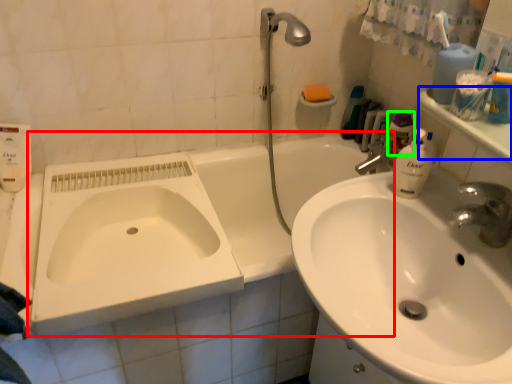
Question: Which object is positioned farthest from bath (highlighted by a red box)? Select from counter top (highlighted by a blue box) and toiletry (highlighted by a green box).

Choices:
 (A) counter top
 (B) toiletry

Answer: (A)